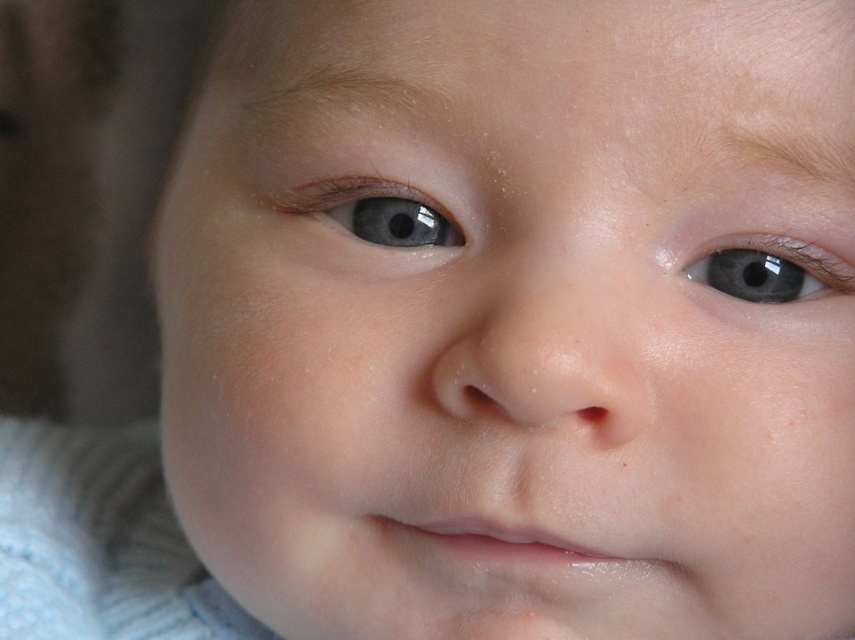
Question: Which of the following is the farthest from the observer?

Choices:
 (A) (799, 294)
 (B) (308, 182)

Answer: (B)

Question: Which object appears farthest from the camera in this image?

Choices:
 (A) blue glossy eye at center
 (B) blue glossy eye at upper right

Answer: (A)

Question: Is blue glossy eye at center above blue glossy eye at upper right?

Choices:
 (A) no
 (B) yes

Answer: (B)

Question: From the image, what is the correct spatial relationship of blue glossy eye at center in relation to blue glossy eye at upper right?

Choices:
 (A) above
 (B) below

Answer: (A)

Question: Is blue glossy eye at center smaller than blue glossy eye at upper right?

Choices:
 (A) yes
 (B) no

Answer: (B)

Question: Which object is closer to the camera taking this photo?

Choices:
 (A) blue glossy eye at upper right
 (B) blue glossy eye at center

Answer: (A)